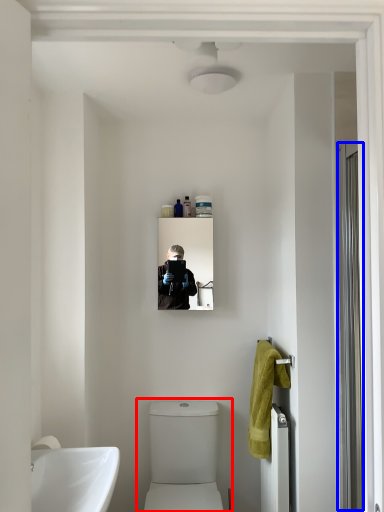
Question: Which of the following is the closest to the observer, toilet (highlighted by a red box) or screen door (highlighted by a blue box)?

Choices:
 (A) toilet
 (B) screen door

Answer: (B)